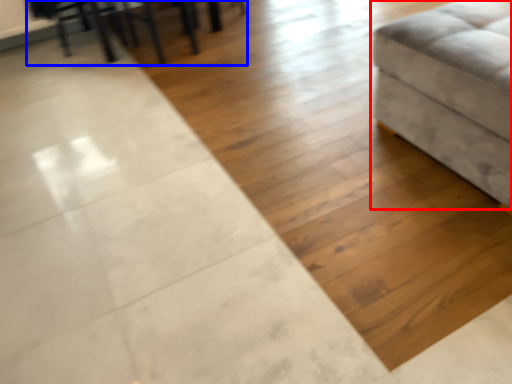
Question: Among these objects, which one is farthest to the camera, furniture (highlighted by a red box) or table (highlighted by a blue box)?

Choices:
 (A) furniture
 (B) table

Answer: (B)